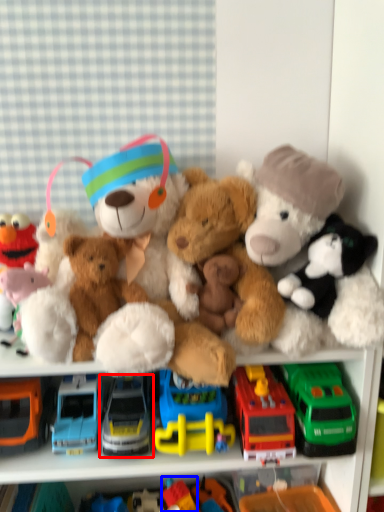
Question: Which point is closer to the camera, truck (highlighted by a red box) or toy (highlighted by a blue box)?

Choices:
 (A) truck
 (B) toy

Answer: (A)